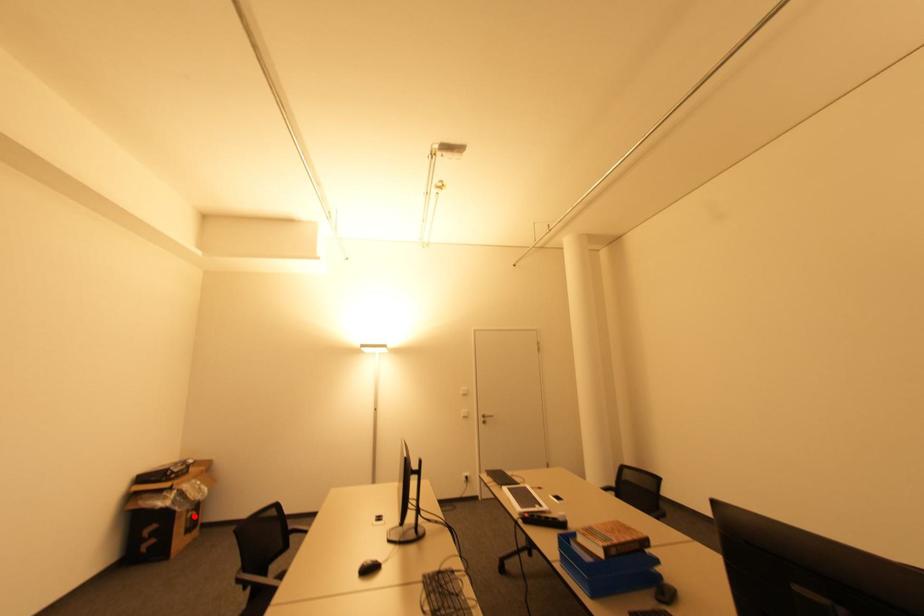
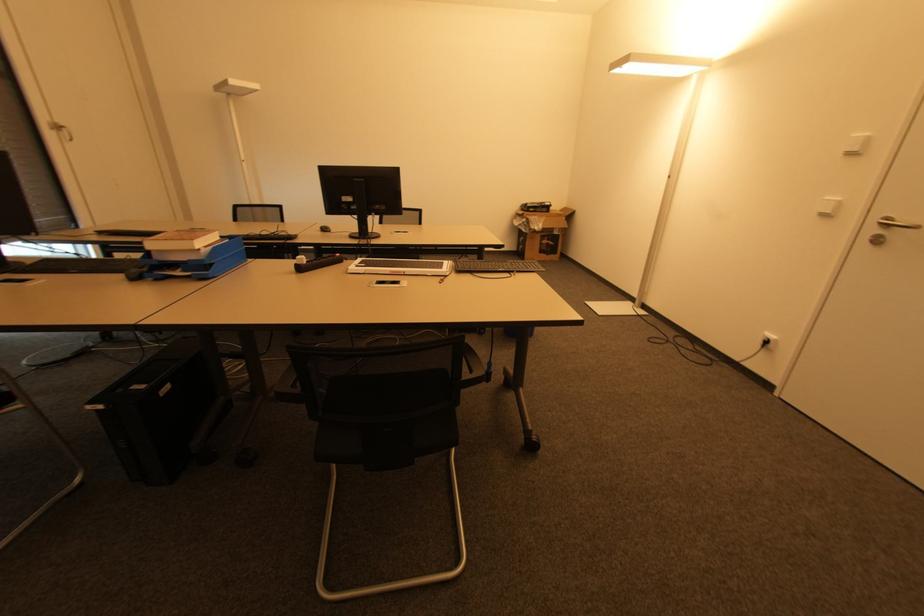
Where in the second image is the point corresponding to the highlighted location from the first image?

(550, 245)